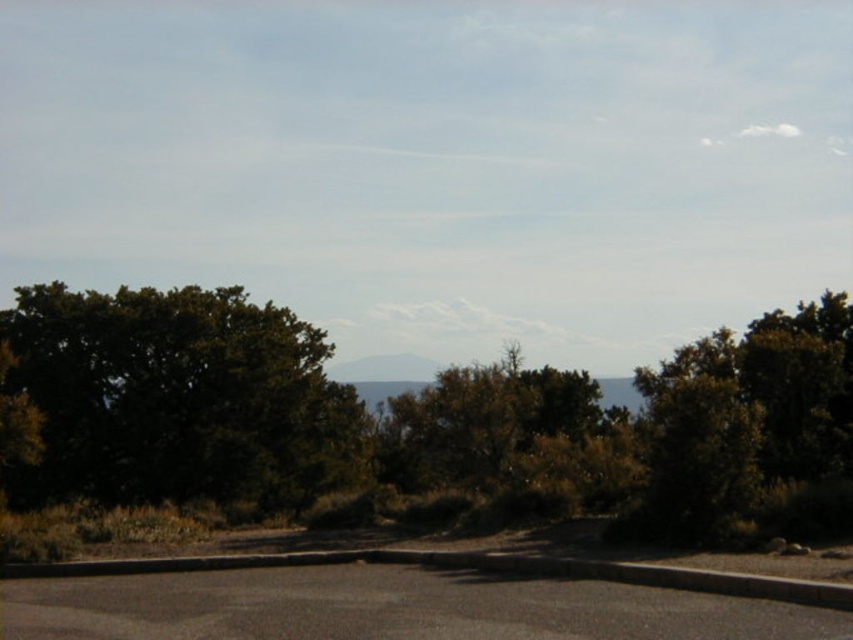
You are standing at the point represented by point (178, 397) and want to walk to the green leafy tree at left. Which direction should you face to walk straight towards it?

You should face towards the green leafy tree at left, which is located at the left side of the scene. Since you are at point (178, 397), you need to walk towards the left to reach it.

You are standing at the center of the paved road in the image. Which direction should you walk to reach the green leafy tree at left?

The green leafy tree at left is located at point (178, 397), which is to the left side of the image. Therefore, you should walk to the left to reach it.

You are a landscape architect designing a walking path. You need to decide where to place a bench so it is shaded by the larger tree. Which tree should you choose between the green leafy tree at left and the green leafy tree at center?

The green leafy tree at center is larger since it is thicker than the green leafy tree at left. Therefore, you should place the bench under the green leafy tree at center for more shade.